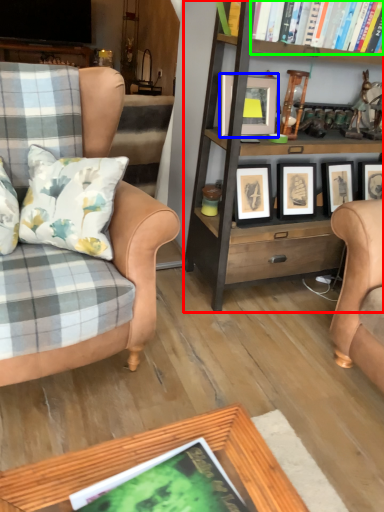
Question: Considering the real-world distances, which object is farthest from bookcase (highlighted by a red box)? picture frame (highlighted by a blue box) or book (highlighted by a green box)?

Choices:
 (A) picture frame
 (B) book

Answer: (B)